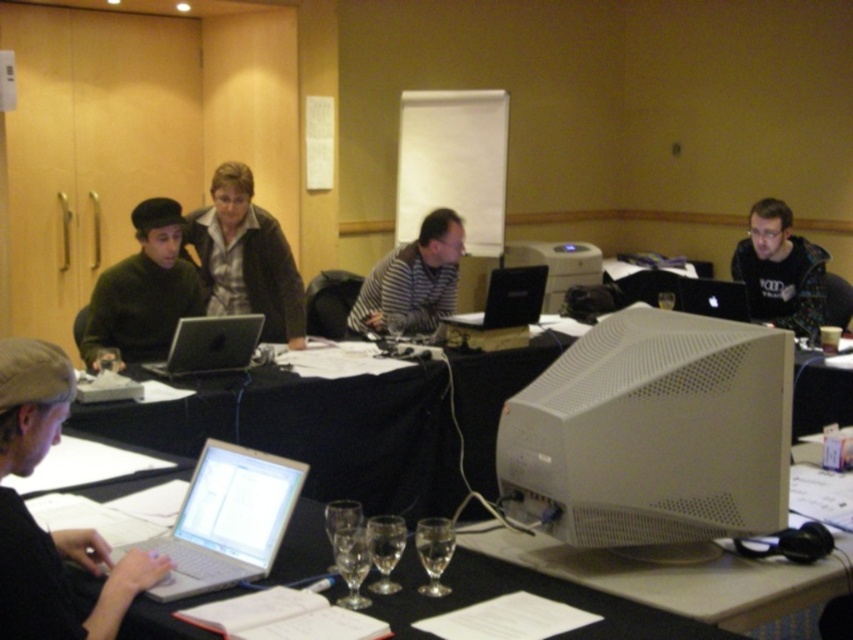
Question: Can you confirm if matte brown sweater at center is wider than clear glass wine glass at lower center?

Choices:
 (A) no
 (B) yes

Answer: (B)

Question: Which object is the farthest from the silver metallic laptop at left?

Choices:
 (A) black glossy laptop at center
 (B) matte black sweater at left

Answer: (A)

Question: Does matte brown sweater at center have a smaller size compared to striped sweater at center?

Choices:
 (A) yes
 (B) no

Answer: (B)

Question: Which object is the closest to the black glossy laptop at right?

Choices:
 (A) black glossy laptop at center
 (B) striped sweater at center
 (C) clear glass wine glass at lower center

Answer: (A)

Question: Does silver metallic laptop at lower left appear on the left side of transparent glass at center?

Choices:
 (A) yes
 (B) no

Answer: (A)

Question: Among these points, which one is nearest to the camera?

Choices:
 (A) [x=267, y=330]
 (B) [x=115, y=305]
 (C) [x=439, y=221]
 (D) [x=289, y=472]

Answer: (D)